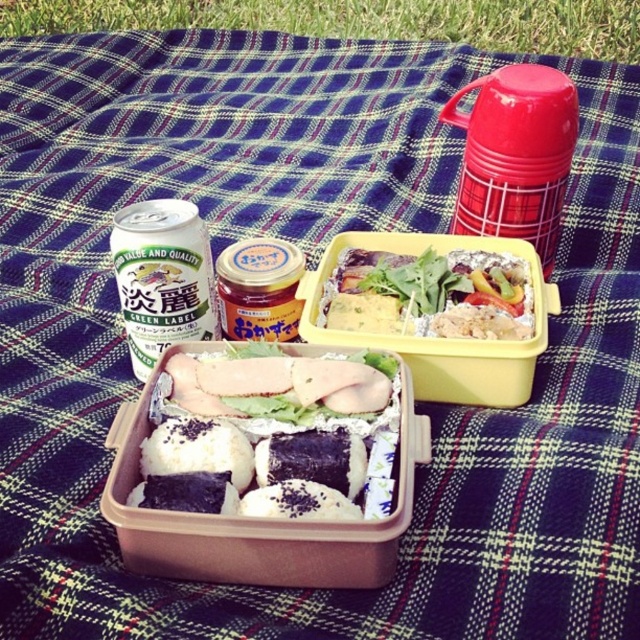
You are planning to pack a lunchbox for a hiking trip and want to know if the white rice with nori at center will fit under the lid of the green label can at left. Can it fit based on their heights?

The white rice with nori at center is not as tall as the green label can at left, so it can fit under the lid of the green label can at left since its height is shorter.

You are at a picnic and want to place a napkin between the vibrant mixed vegetables at center and the green label can at left. Based on their positions, which object should you place the napkin next to first?

The green label can at left should be placed first because the vibrant mixed vegetables at center is positioned on the right side of it.

You are standing at the picnic area and want to pick up an item. Which of the two points, point (502, 257) or point (184, 273), is closer to you?

Point (502, 257) is closer to you because it is further to the viewer than point (184, 273).